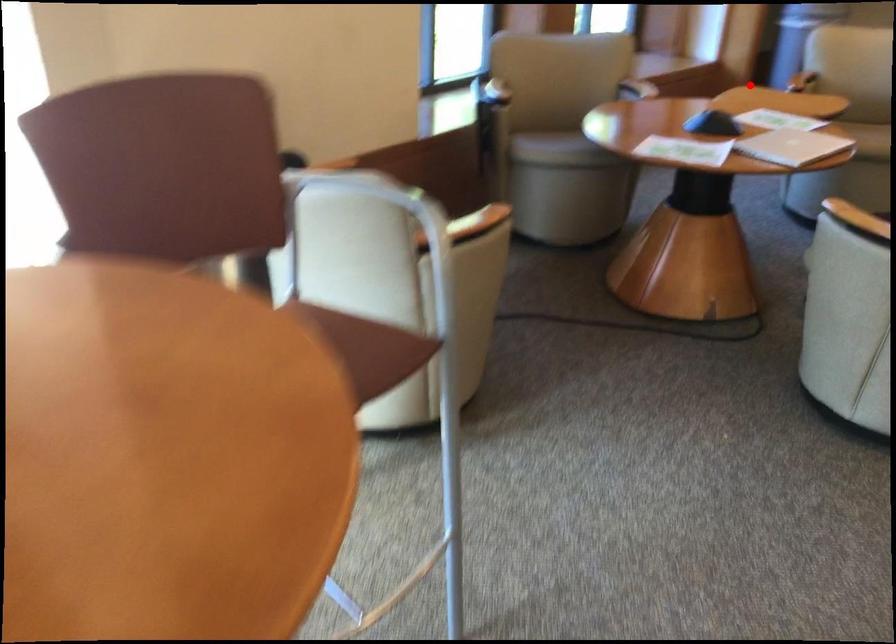
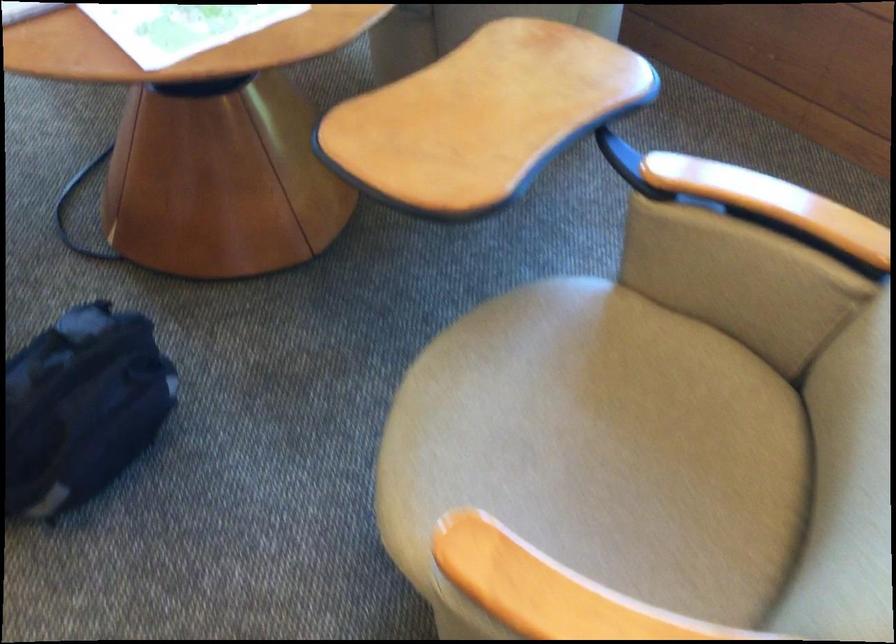
In the second image, find the point that corresponds to the highlighted location in the first image.

(483, 116)